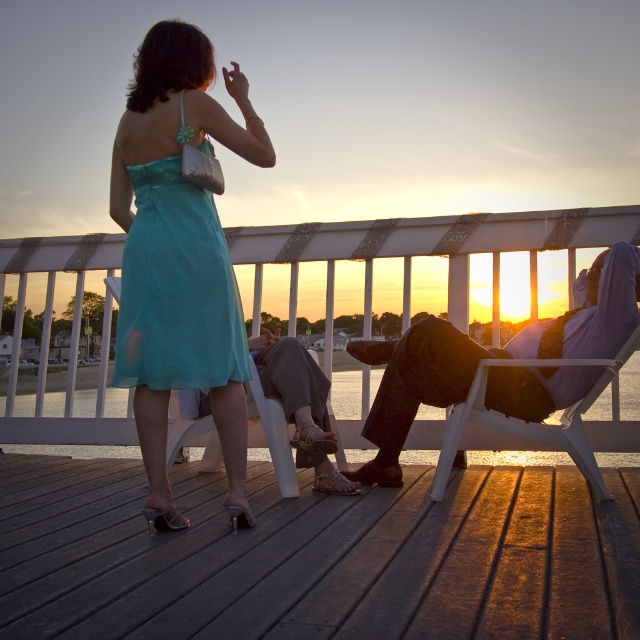
Which is in front, point (195, 64) or point (198, 401)?

Point (195, 64) is in front.

Measure the distance between point (232,397) and camera.

Point (232,397) is 8.60 feet away from camera.

Find the location of `teal chiffon dress at center`. teal chiffon dress at center is located at coordinates (179, 257).

Can you confirm if wooden at lower center is wider than teal chiffon dress at center?

Yes.

In the scene shown: Can you confirm if wooden at lower center is positioned below teal chiffon dress at center?

Yes.

Does point (616, 630) lie behind point (134, 128)?

No, it is in front of (134, 128).

Locate an element on the screen. This screenshot has height=640, width=640. wooden at lower center is located at coordinates (317, 556).

Can you confirm if wooden at lower center is taller than teal satin dress at center?

In fact, wooden at lower center may be shorter than teal satin dress at center.

Is wooden at lower center shorter than teal satin dress at center?

Correct, wooden at lower center is not as tall as teal satin dress at center.

I want to click on wooden at lower center, so click(317, 556).